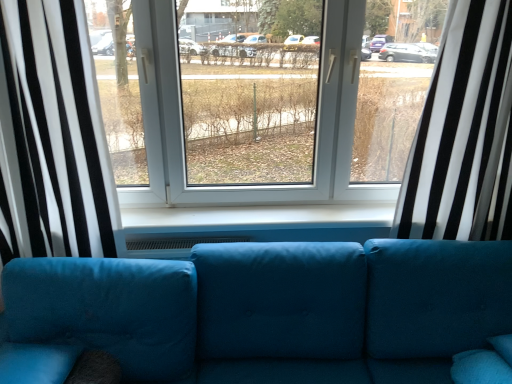
Question: Does black/white striped curtain at left, the second curtain positioned from the right, appear on the right side of white striped curtain at right, which is the second curtain from left to right?

Choices:
 (A) yes
 (B) no

Answer: (B)

Question: Can you confirm if black/white striped curtain at left, the second curtain positioned from the right, is bigger than white striped curtain at right, the 1th curtain when ordered from right to left?

Choices:
 (A) yes
 (B) no

Answer: (A)

Question: From a real-world perspective, does black/white striped curtain at left, the second curtain positioned from the right, stand above white striped curtain at right, the 1th curtain when ordered from right to left?

Choices:
 (A) yes
 (B) no

Answer: (B)

Question: Is black/white striped curtain at left, the second curtain positioned from the right, completely or partially outside of white striped curtain at right, which is the second curtain from left to right?

Choices:
 (A) no
 (B) yes

Answer: (B)

Question: From a real-world perspective, is black/white striped curtain at left, marked as the 1th curtain in a left-to-right arrangement, below white striped curtain at right, the 1th curtain when ordered from right to left?

Choices:
 (A) no
 (B) yes

Answer: (B)

Question: Does black/white striped curtain at left, marked as the 1th curtain in a left-to-right arrangement, contain white striped curtain at right, which is the second curtain from left to right?

Choices:
 (A) yes
 (B) no

Answer: (B)

Question: Is black/white striped curtain at left, the second curtain positioned from the right, looking in the opposite direction of velvet blue couch at center?

Choices:
 (A) no
 (B) yes

Answer: (A)

Question: Considering the relative sizes of black/white striped curtain at left, the second curtain positioned from the right, and velvet blue couch at center in the image provided, is black/white striped curtain at left, the second curtain positioned from the right, smaller than velvet blue couch at center?

Choices:
 (A) no
 (B) yes

Answer: (B)

Question: Can you confirm if black/white striped curtain at left, marked as the 1th curtain in a left-to-right arrangement, is positioned to the left of velvet blue couch at center?

Choices:
 (A) yes
 (B) no

Answer: (A)

Question: Can you confirm if black/white striped curtain at left, marked as the 1th curtain in a left-to-right arrangement, is taller than velvet blue couch at center?

Choices:
 (A) no
 (B) yes

Answer: (B)

Question: Does black/white striped curtain at left, marked as the 1th curtain in a left-to-right arrangement, come in front of velvet blue couch at center?

Choices:
 (A) no
 (B) yes

Answer: (A)

Question: From a real-world perspective, is black/white striped curtain at left, marked as the 1th curtain in a left-to-right arrangement, over velvet blue couch at center?

Choices:
 (A) no
 (B) yes

Answer: (B)

Question: Considering the relative positions of velvet blue couch at center and black/white striped curtain at left, the second curtain positioned from the right, in the image provided, is velvet blue couch at center to the left of black/white striped curtain at left, the second curtain positioned from the right, from the viewer's perspective?

Choices:
 (A) no
 (B) yes

Answer: (A)